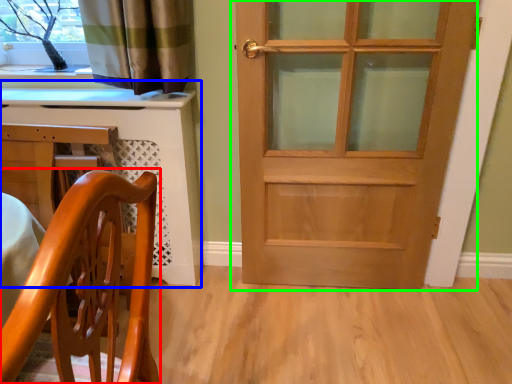
Question: Which object is positioned closest to chair (highlighted by a red box)? Select from computer desk (highlighted by a blue box) and door (highlighted by a green box).

Choices:
 (A) computer desk
 (B) door

Answer: (A)